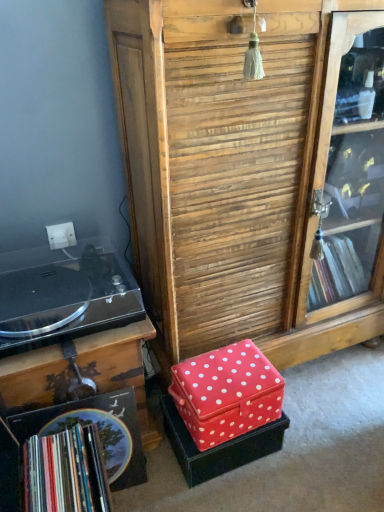
The image size is (384, 512). What are the coordinates of `empty space that is ontop of multicolored paper book at lower left (from a real-world perspective)` in the screenshot? It's located at (61, 468).